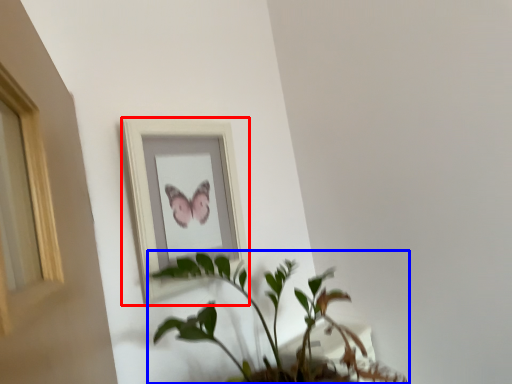
Question: Among these objects, which one is farthest to the camera, picture frame (highlighted by a red box) or houseplant (highlighted by a blue box)?

Choices:
 (A) picture frame
 (B) houseplant

Answer: (A)